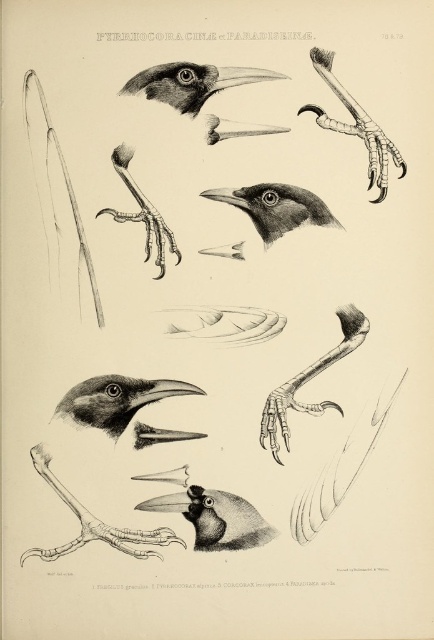
Question: Is smooth gray claw at center smaller than smooth gray claw at upper right?

Choices:
 (A) no
 (B) yes

Answer: (B)

Question: Which of the following is the closest to the observer?

Choices:
 (A) (187, 508)
 (B) (243, 186)
 (C) (347, 342)

Answer: (A)

Question: Which of the following is the closest to the observer?

Choices:
 (A) (207, 497)
 (B) (325, 72)

Answer: (B)

Question: Which point appears closest to the camera in this image?

Choices:
 (A) (347, 353)
 (B) (395, 150)
 (C) (314, 211)
 (D) (157, 216)

Answer: (B)

Question: Does smooth black crow at center have a smaller size compared to smooth black beak at center?

Choices:
 (A) no
 (B) yes

Answer: (A)

Question: Does smooth black beak at center appear on the left side of smooth gray claw at center?

Choices:
 (A) no
 (B) yes

Answer: (B)